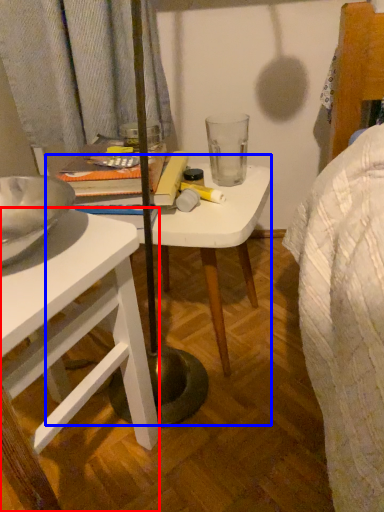
Question: Which point is closer to the camera, desk (highlighted by a red box) or table (highlighted by a blue box)?

Choices:
 (A) desk
 (B) table

Answer: (A)